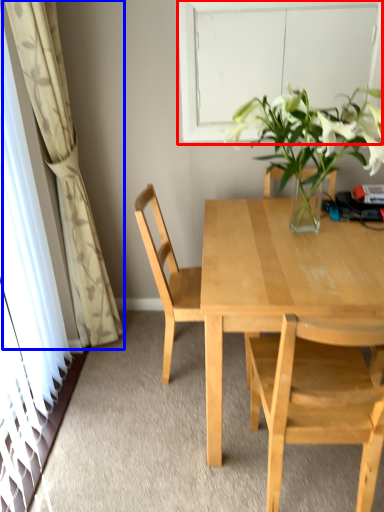
Question: Which object appears farthest to the camera in this image, window (highlighted by a red box) or curtain (highlighted by a blue box)?

Choices:
 (A) window
 (B) curtain

Answer: (A)